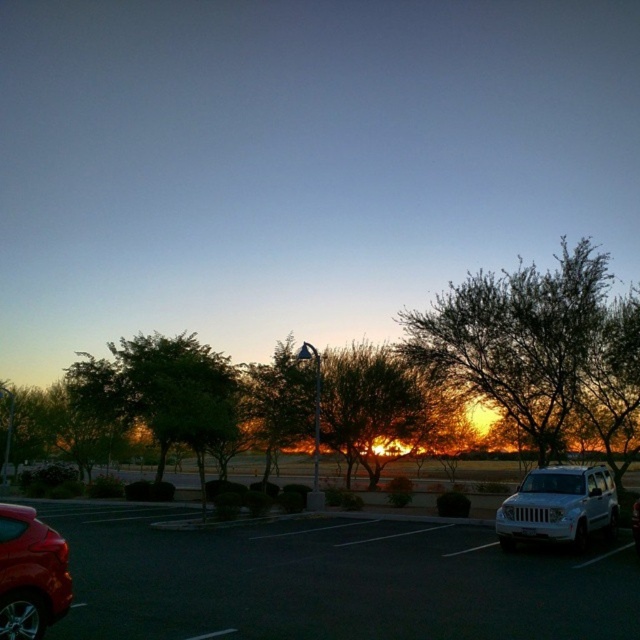
Question: Can you confirm if metallic silver car at lower right is positioned above shiny red car at lower left?

Choices:
 (A) no
 (B) yes

Answer: (A)

Question: Observing the image, what is the correct spatial positioning of white matte/soft jeep at lower right in reference to shiny red car at lower left?

Choices:
 (A) above
 (B) below

Answer: (B)

Question: Estimate the real-world distances between objects in this image. Which object is farther from the shiny red car at lower left?

Choices:
 (A) green leafy tree at center
 (B) white matte/soft jeep at lower right

Answer: (A)

Question: Among these points, which one is nearest to the camera?

Choices:
 (A) (104, 616)
 (B) (605, 384)

Answer: (A)

Question: Which object appears closest to the camera in this image?

Choices:
 (A) green leafy tree at center
 (B) shiny red car at lower left
 (C) green leafy tree at upper right

Answer: (B)

Question: Observing the image, what is the correct spatial positioning of metallic silver car at lower right in reference to shiny red car at lower left?

Choices:
 (A) below
 (B) above

Answer: (A)